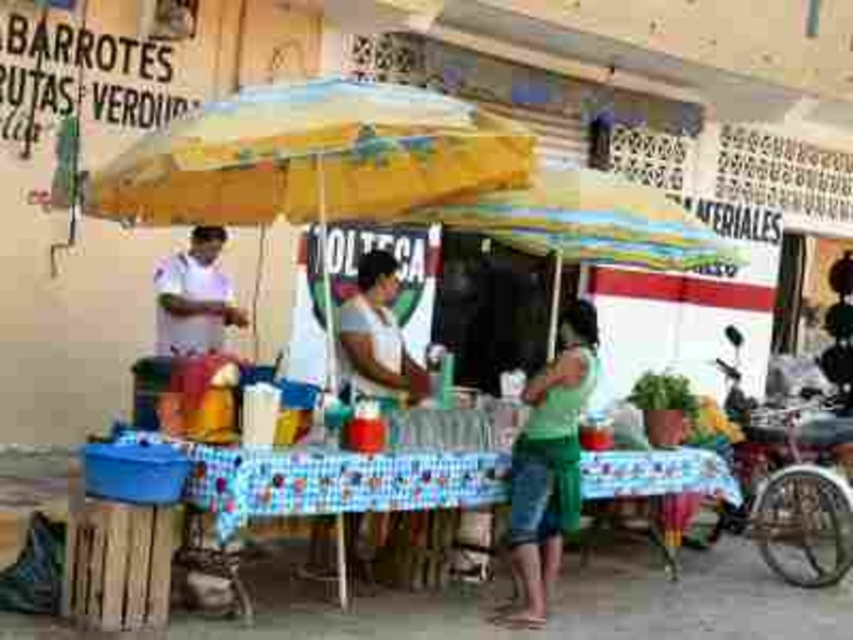
You are a customer at the food stall and want to place your green cotton shirt at center on the blue checkered tablecloth at center. Will the tablecloth be large enough to fully cover the shirt?

The blue checkered tablecloth at center has a larger width than the green cotton shirt at center, so it will be large enough to fully cover the shirt.